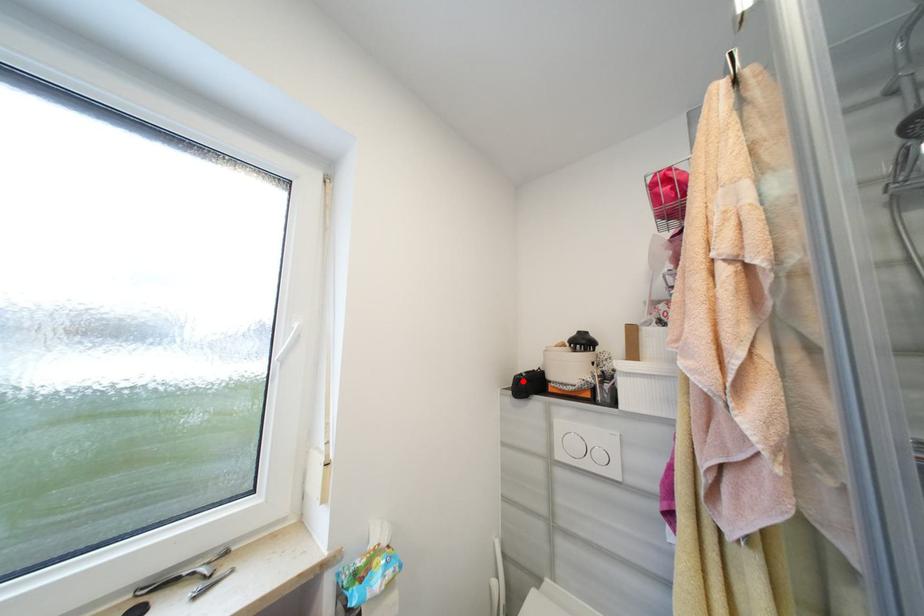
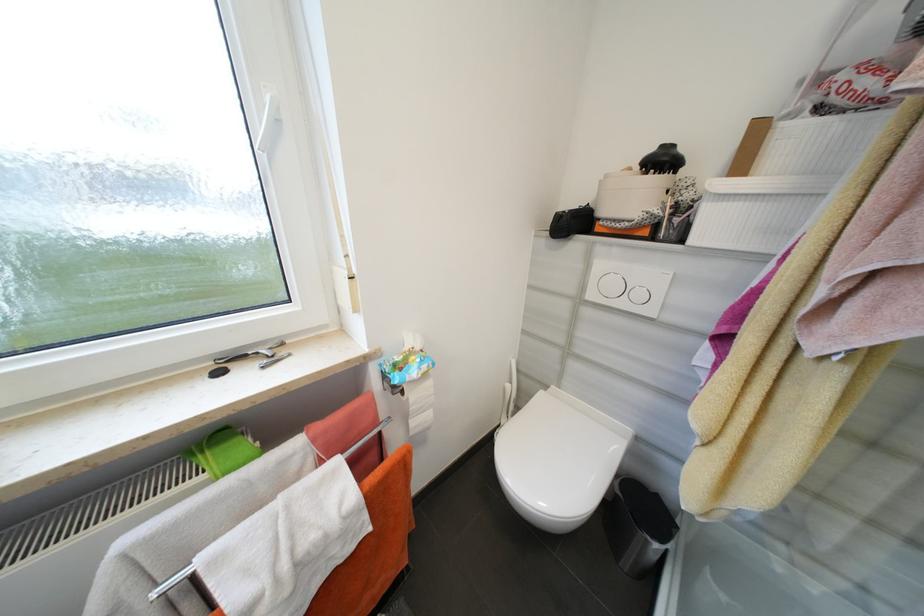
Where in the second image is the point corresponding to the highlighted location from the first image?

(565, 217)